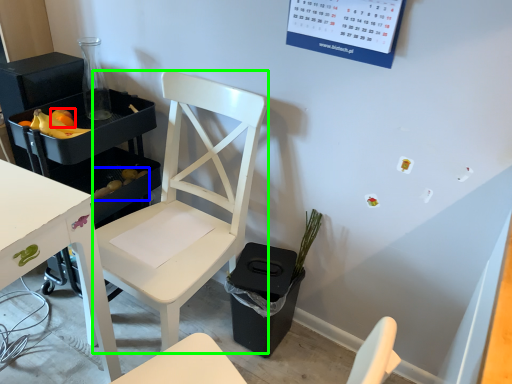
Question: Which object is positioned closest to fruit (highlighted by a red box)? Select from food (highlighted by a blue box) and chair (highlighted by a green box).

Choices:
 (A) food
 (B) chair

Answer: (A)